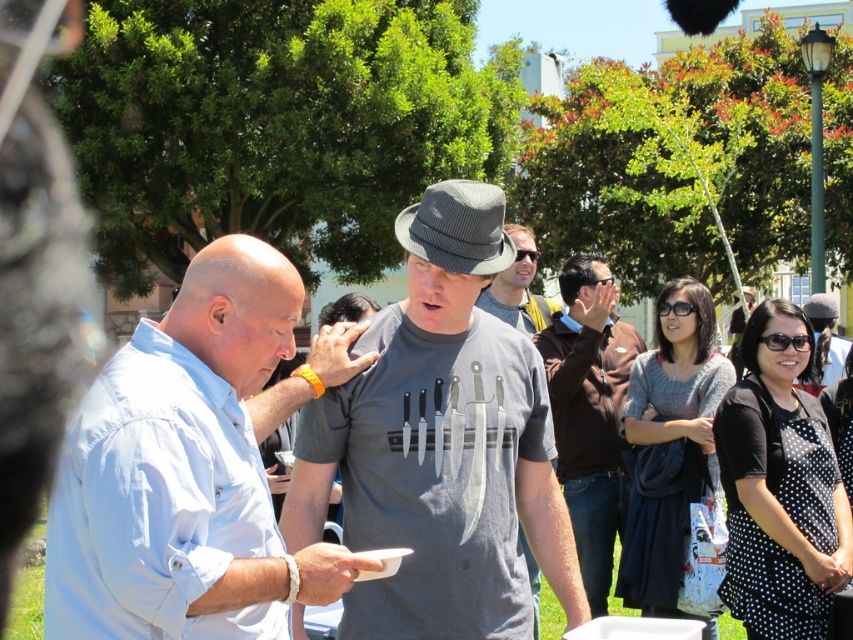
You are standing in the park and see the brown leather jacket at center and the gray matte shirt at center. Which one is positioned lower in the image?

The brown leather jacket at center is located below the gray matte shirt at center, so it is positioned lower in the image.

You are at a park and see two people wearing a light blue cotton shirt at center and a brown leather jacket at center. Which one is more to the left?

The light blue cotton shirt at center is more to the left side of the brown leather jacket at center.

You are at a park and see two people wearing the brown leather jacket at center and the gray matte shirt at center. Which one is more to the left?

The brown leather jacket at center is positioned on the left side of gray matte shirt at center, so the brown leather jacket at center is more to the left.